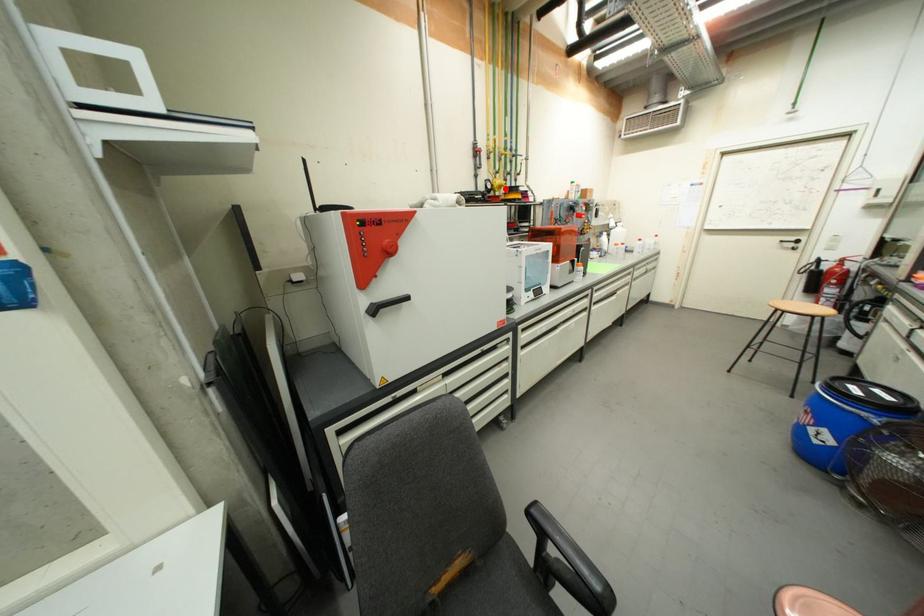
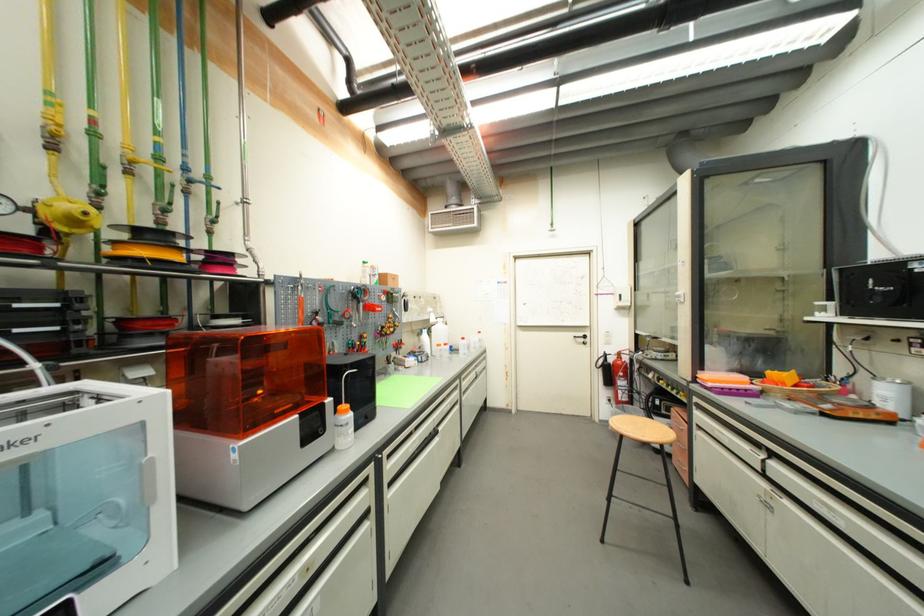
The point at the highlighted location is marked in the first image. Where is the corresponding point in the second image?

(82, 224)